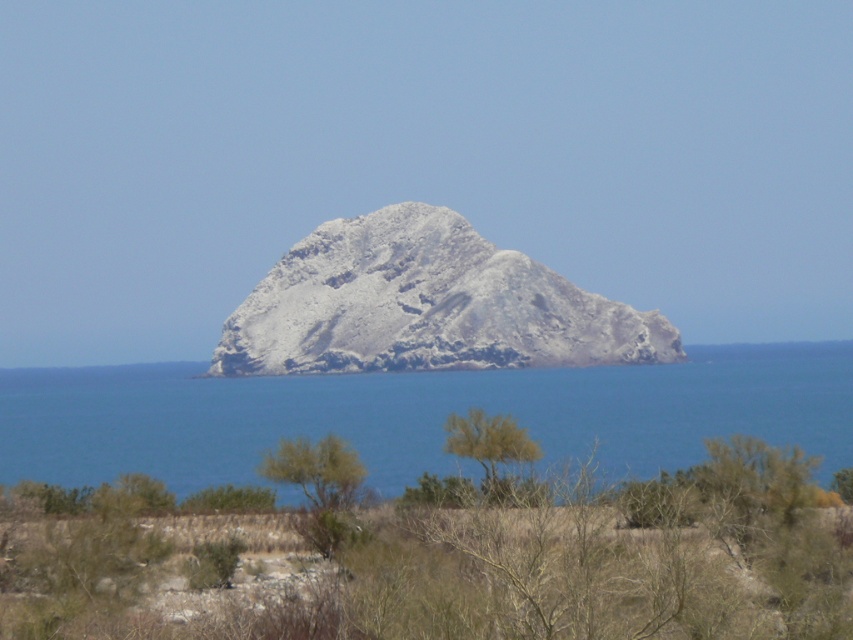
You are standing at the point marked as point (318, 484). What object is exactly at your current location?

The green leafy shrub at center is located at point (318, 484), so the object exactly at your current location is the green leafy shrub at center.

You are a hiker who wants to take a photo of both the gray rocky mountain at center and the green leafy tree at center. Which object should you stand closer to in order to capture both in the same frame?

You should stand closer to the green leafy tree at center because it is smaller than the gray rocky mountain at center. This way, both objects will appear balanced in the photo.